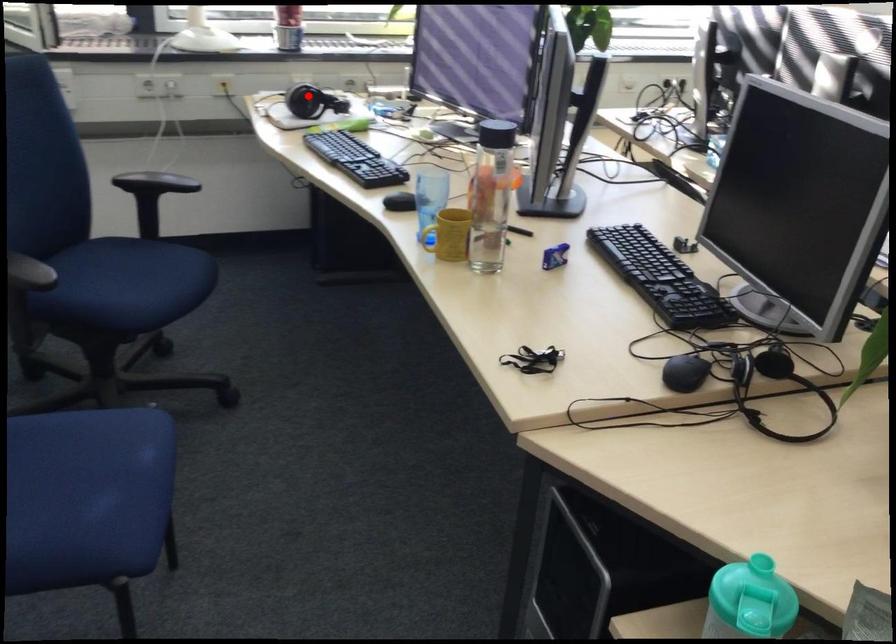
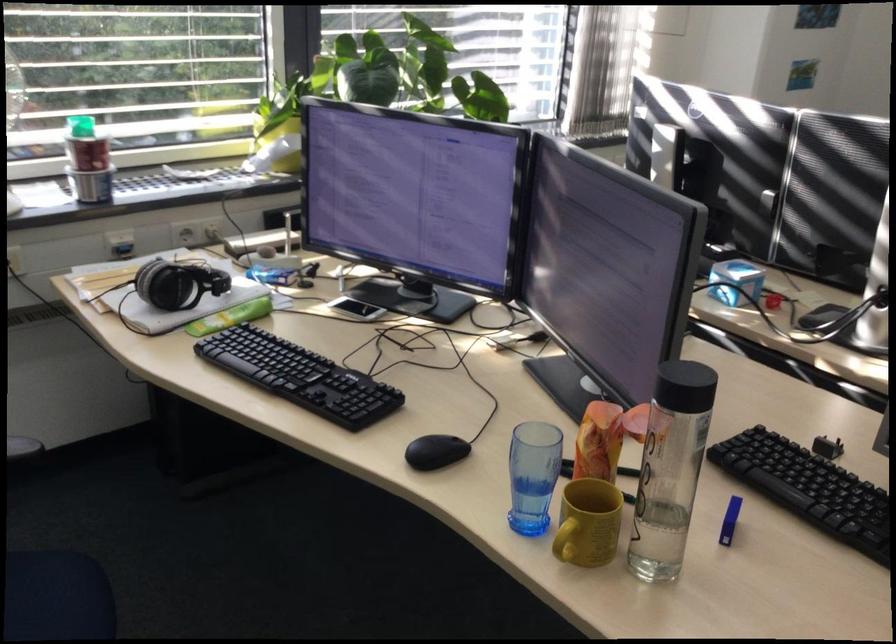
Find the pixel in the second image that matches the highlighted location in the first image.

(177, 283)